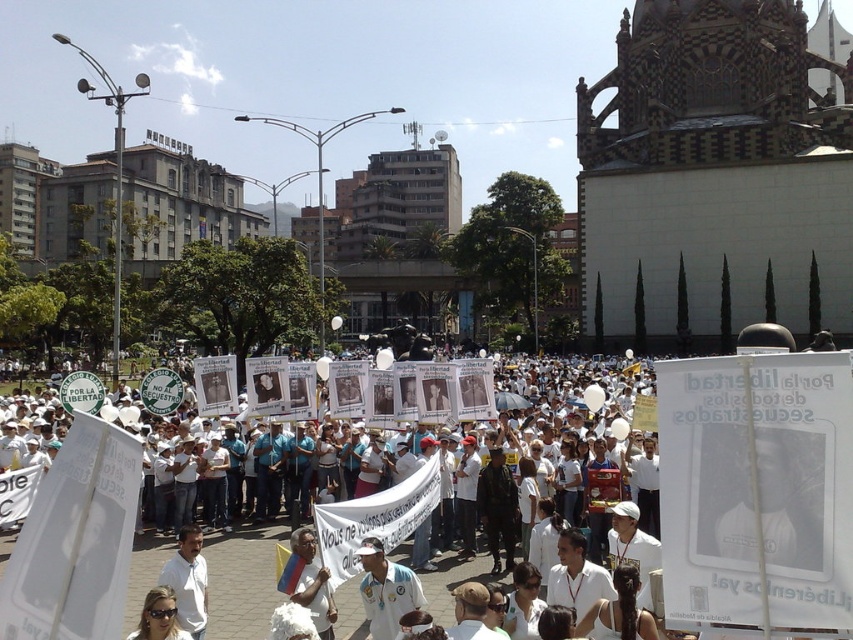
Based on the photo, you are a photographer trying to capture a clear shot of both the white fabric shirt at center and the white shirt at center. Since both are in the center, which one will appear larger in your photo?

The white fabric shirt at center appears larger because it is closer to the viewer than the white shirt at center.